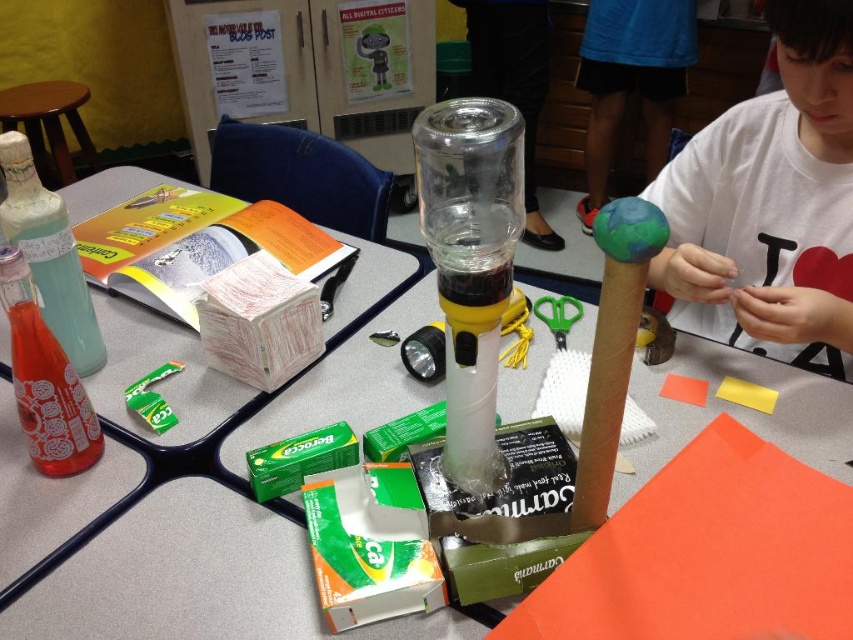
Does white cotton shirt at upper right have a larger size compared to wooden stool at upper left?

Actually, white cotton shirt at upper right might be smaller than wooden stool at upper left.

Is white cotton shirt at upper right below wooden stool at upper left?

Indeed, white cotton shirt at upper right is positioned under wooden stool at upper left.

Describe the element at coordinates (770, 202) in the screenshot. I see `white cotton shirt at upper right` at that location.

This screenshot has width=853, height=640. I want to click on white cotton shirt at upper right, so click(x=770, y=202).

Does point (32, 608) come in front of point (160, 428)?

That is True.

Does translucent plastic bottle at center appear over green plastic tape at center?

Indeed, translucent plastic bottle at center is positioned over green plastic tape at center.

Where is `translucent plastic bottle at center`? translucent plastic bottle at center is located at coordinates (194, 477).

Does translucent plastic bottle at center have a lesser height compared to translucent glass bottle at left?

Incorrect, translucent plastic bottle at center's height does not fall short of translucent glass bottle at left's.

Is translucent plastic bottle at center bigger than translucent glass bottle at left?

Correct, translucent plastic bottle at center is larger in size than translucent glass bottle at left.

The width and height of the screenshot is (853, 640). What do you see at coordinates (194, 477) in the screenshot?
I see `translucent plastic bottle at center` at bounding box center [194, 477].

Where is `translucent plastic bottle at center`? The image size is (853, 640). translucent plastic bottle at center is located at coordinates (194, 477).